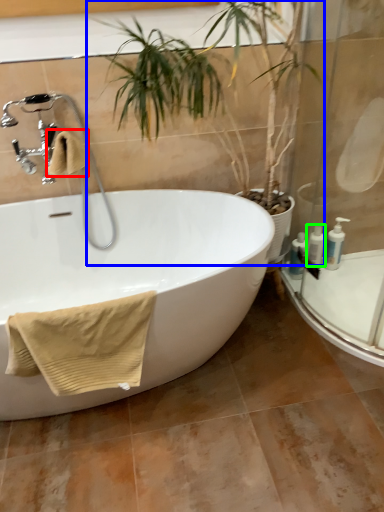
Question: Which object is the farthest from bath towel (highlighted by a red box)? Choose among these: houseplant (highlighted by a blue box) or toiletry (highlighted by a green box).

Choices:
 (A) houseplant
 (B) toiletry

Answer: (B)